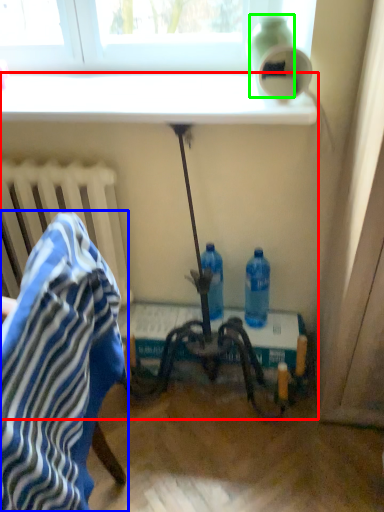
Question: Considering the real-world distances, which object is closest to table (highlighted by a red box)? chair (highlighted by a blue box) or bottle (highlighted by a green box).

Choices:
 (A) chair
 (B) bottle

Answer: (B)